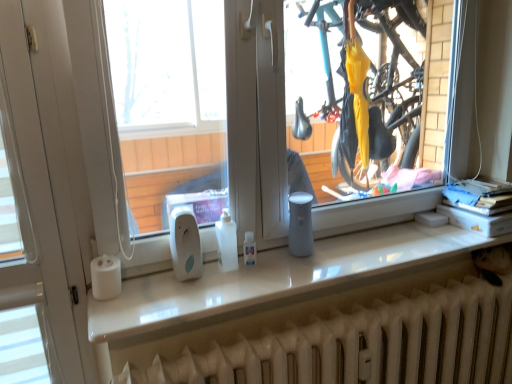
Where is `white glossy counter top at center`? Image resolution: width=512 pixels, height=384 pixels. white glossy counter top at center is located at coordinates (275, 279).

Image resolution: width=512 pixels, height=384 pixels. What do you see at coordinates (106, 277) in the screenshot? I see `white matte paper towel at left` at bounding box center [106, 277].

Locate an element on the screen. The image size is (512, 384). white glossy counter top at center is located at coordinates pos(275,279).

Which object is thinner, white matte radiator at lower center or white glossy counter top at center?

With smaller width is white matte radiator at lower center.

Between white matte radiator at lower center and white glossy counter top at center, which one has less height?

Standing shorter between the two is white glossy counter top at center.

Can you confirm if white matte radiator at lower center is positioned to the left of white glossy counter top at center?

In fact, white matte radiator at lower center is to the right of white glossy counter top at center.

Is white matte radiator at lower center with white glossy counter top at center?

white matte radiator at lower center is not next to white glossy counter top at center, and they're not touching.

Is point (499, 346) closer to camera compared to point (102, 299)?

No, (499, 346) is behind (102, 299).

Which is more to the left, white matte radiator at lower center or white matte paper towel at left?

white matte paper towel at left.

Between white matte radiator at lower center and white matte paper towel at left, which one has less height?

white matte paper towel at left.

Looking at the image, does white matte radiator at lower center seem bigger or smaller compared to white matte paper towel at left?

white matte radiator at lower center is bigger than white matte paper towel at left.

Could white matte radiator at lower center be considered to be inside white matte paper towel at left?

No, white matte radiator at lower center is not surrounded by white matte paper towel at left.

Is white matte paper towel at left further to the viewer compared to white matte radiator at lower center?

That is True.

From the image's perspective, which object appears higher, white matte paper towel at left or white matte radiator at lower center?

From the image's view, white matte paper towel at left is above.

Can you tell me how much white matte paper towel at left and white matte radiator at lower center differ in facing direction?

The angular difference between white matte paper towel at left and white matte radiator at lower center is 0.0127 degrees.

Between point (250, 273) and point (208, 373), which one is positioned in front?

The point (208, 373) is closer to the camera.

Is white glossy counter top at center positioned beyond the bounds of white matte radiator at lower center?

Indeed, white glossy counter top at center is completely outside white matte radiator at lower center.

Does white glossy counter top at center have a smaller size compared to white matte radiator at lower center?

Correct, white glossy counter top at center occupies less space than white matte radiator at lower center.

From a real-world perspective, between white glossy counter top at center and white matte radiator at lower center, who is vertically higher?

white glossy counter top at center.

How much distance is there between white matte paper towel at left and white glossy counter top at center?

white matte paper towel at left is 18.89 inches away from white glossy counter top at center.

Does white matte paper towel at left contain white glossy counter top at center?

Definitely not — white glossy counter top at center is not inside white matte paper towel at left.

From the image's perspective, between white matte paper towel at left and white glossy counter top at center, who is located below?

From the image's view, white matte paper towel at left is below.

Does white matte paper towel at left have a greater height compared to white glossy counter top at center?

Yes, white matte paper towel at left is taller than white glossy counter top at center.

Looking at this image, from the image's perspective, is white glossy counter top at center on top of white matte paper towel at left?

Indeed, from the image's perspective, white glossy counter top at center is shown above white matte paper towel at left.

Is white glossy counter top at center in contact with white matte paper towel at left?

white glossy counter top at center and white matte paper towel at left are clearly separated.

Is white glossy counter top at center positioned behind white matte paper towel at left?

No, white glossy counter top at center is closer to the camera.

Does white glossy counter top at center have a greater height compared to white matte paper towel at left?

In fact, white glossy counter top at center may be shorter than white matte paper towel at left.

Locate an element on the screen. counter top on the left of white matte radiator at lower center is located at coordinates (275, 279).

You are a GUI agent. You are given a task and a screenshot of the screen. Output one action in this format:
    pyautogui.click(x=<x>, y=<y>)
    Task: Click on the radiator below the white matte paper towel at left (from the image's perspective)
    
    Given the screenshot: What is the action you would take?
    pyautogui.click(x=367, y=345)

From the image, which object appears to be nearer to white glossy counter top at center, white matte radiator at lower center or white matte paper towel at left?

white matte radiator at lower center is closer to white glossy counter top at center.

When comparing their distances from white matte radiator at lower center, does white glossy counter top at center or white matte paper towel at left seem closer?

white glossy counter top at center is closer to white matte radiator at lower center.

Estimate the real-world distances between objects in this image. Which object is further from white matte paper towel at left, white glossy counter top at center or white matte radiator at lower center?

white matte radiator at lower center lies further to white matte paper towel at left than the other object.

When comparing their distances from white matte radiator at lower center, does white matte paper towel at left or white glossy counter top at center seem further?

white matte paper towel at left is positioned further to the anchor white matte radiator at lower center.

Consider the image. Looking at the image, which one is located closer to white glossy counter top at center, white matte paper towel at left or white matte radiator at lower center?

The object closer to white glossy counter top at center is white matte radiator at lower center.

Based on their spatial positions, is white matte radiator at lower center or white glossy counter top at center closer to white matte paper towel at left?

white glossy counter top at center is closer to white matte paper towel at left.

Where is `counter top between white matte paper towel at left and white matte radiator at lower center in the horizontal direction`? This screenshot has height=384, width=512. counter top between white matte paper towel at left and white matte radiator at lower center in the horizontal direction is located at coordinates (275, 279).